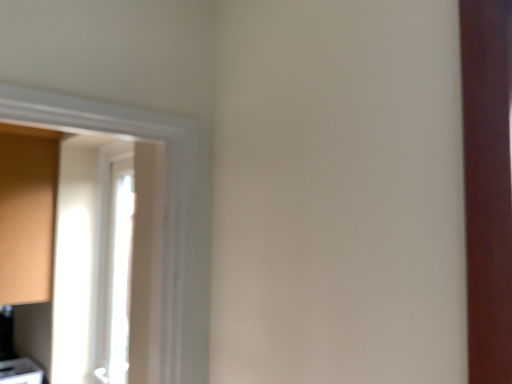
Question: Does matte white cabinet at lower left, placed as the 1th cabinetry when sorted from bottom to top, lie behind white glossy door at left?

Choices:
 (A) yes
 (B) no

Answer: (A)

Question: Is matte white cabinet at lower left, the second cabinetry positioned from the top, outside white glossy door at left?

Choices:
 (A) yes
 (B) no

Answer: (A)

Question: Considering the relative sizes of matte white cabinet at lower left, the second cabinetry positioned from the top, and white glossy door at left in the image provided, is matte white cabinet at lower left, the second cabinetry positioned from the top, bigger than white glossy door at left?

Choices:
 (A) yes
 (B) no

Answer: (B)

Question: Is matte white cabinet at lower left, the second cabinetry positioned from the top, positioned far away from white glossy door at left?

Choices:
 (A) yes
 (B) no

Answer: (B)

Question: Is matte white cabinet at lower left, placed as the 1th cabinetry when sorted from bottom to top, facing away from white glossy door at left?

Choices:
 (A) no
 (B) yes

Answer: (A)

Question: From the image's perspective, is white glossy door at left located above or below matte white cabinet at lower left, the second cabinetry positioned from the top?

Choices:
 (A) above
 (B) below

Answer: (A)

Question: In the image, is white glossy door at left on the left side or the right side of matte white cabinet at lower left, the second cabinetry positioned from the top?

Choices:
 (A) left
 (B) right

Answer: (B)

Question: From their relative heights in the image, would you say white glossy door at left is taller or shorter than matte white cabinet at lower left, the second cabinetry positioned from the top?

Choices:
 (A) tall
 (B) short

Answer: (A)

Question: Is white glossy door at left spatially inside matte white cabinet at lower left, placed as the 1th cabinetry when sorted from bottom to top, or outside of it?

Choices:
 (A) inside
 (B) outside

Answer: (B)

Question: In terms of height, does matte white cabinet at lower left, placed as the 1th cabinetry when sorted from bottom to top, look taller or shorter compared to matte wood cabinet at left, which ranks as the 1th cabinetry in top-to-bottom order?

Choices:
 (A) tall
 (B) short

Answer: (B)

Question: In terms of width, does matte white cabinet at lower left, placed as the 1th cabinetry when sorted from bottom to top, look wider or thinner when compared to matte wood cabinet at left, which ranks as the 1th cabinetry in top-to-bottom order?

Choices:
 (A) wide
 (B) thin

Answer: (B)

Question: Is point click(11, 380) positioned closer to the camera than point click(32, 140)?

Choices:
 (A) farther
 (B) closer

Answer: (B)

Question: Is matte white cabinet at lower left, the second cabinetry positioned from the top, inside the boundaries of matte wood cabinet at left, which ranks as the 1th cabinetry in top-to-bottom order, or outside?

Choices:
 (A) inside
 (B) outside

Answer: (B)

Question: In the image, is white glossy door at left on the left side or the right side of matte wood cabinet at left, which ranks as the 1th cabinetry in top-to-bottom order?

Choices:
 (A) left
 (B) right

Answer: (B)

Question: Considering their positions, is white glossy door at left located in front of or behind matte wood cabinet at left, placed as the second cabinetry when sorted from bottom to top?

Choices:
 (A) behind
 (B) front

Answer: (B)